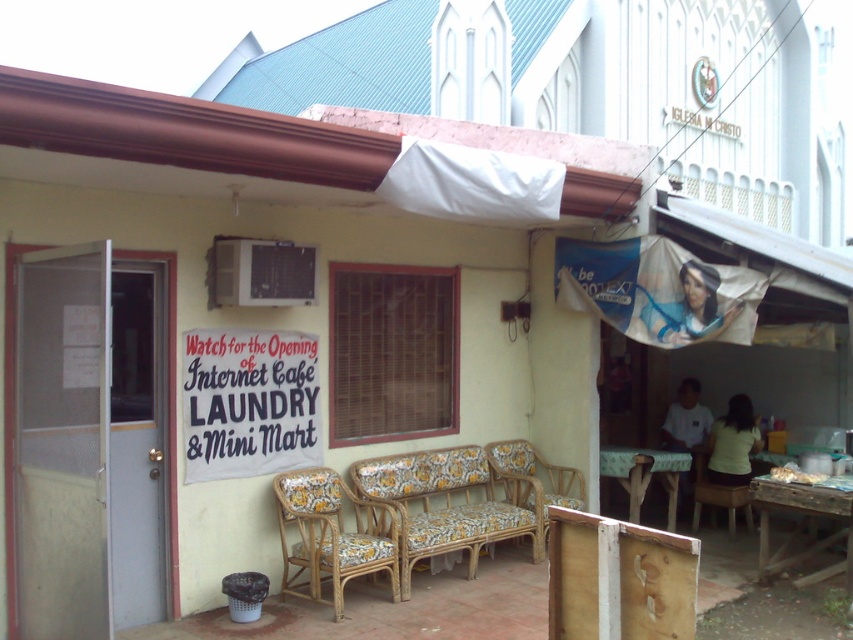
Question: Which object is positioned closest to the yellow floral fabric chair at center?

Choices:
 (A) wooden chair at lower right
 (B) white paper sign at center

Answer: (A)

Question: From the image, what is the correct spatial relationship of floral fabric cushioned chair at center in relation to wooden chair at lower right?

Choices:
 (A) left
 (B) right

Answer: (A)

Question: Can you confirm if wooden signboard at lower right is thinner than floral fabric cushioned chair at center?

Choices:
 (A) yes
 (B) no

Answer: (A)

Question: Is yellow floral fabric chair at center smaller than wooden chair at lower right?

Choices:
 (A) no
 (B) yes

Answer: (A)

Question: Which point is closer to the camera taking this photo?

Choices:
 (A) (653, 545)
 (B) (553, 490)

Answer: (A)

Question: Which of these objects is positioned farthest from the wooden signboard at lower right?

Choices:
 (A) floral fabric cushioned chair at center
 (B) yellow floral fabric chair at center
 (C) white paper sign at center

Answer: (B)